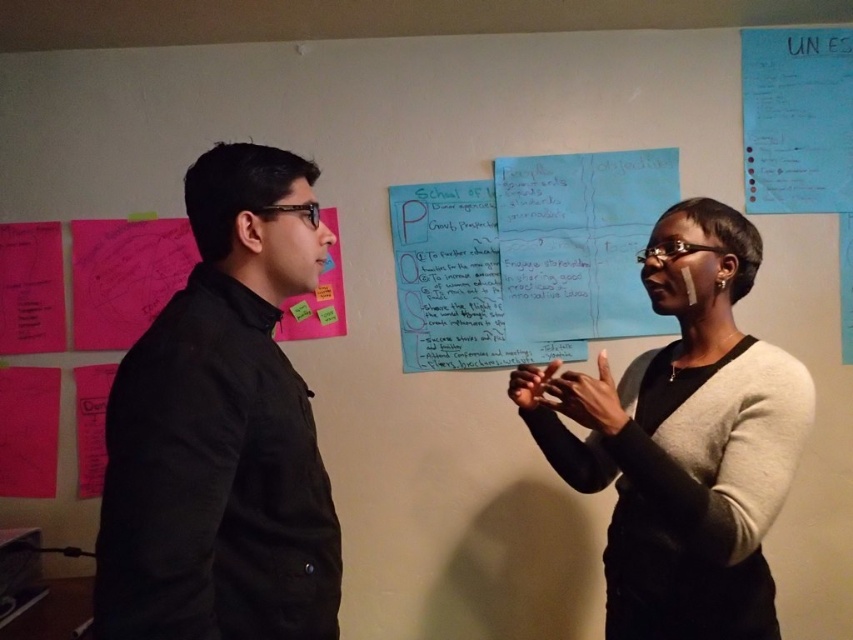
You are standing in the room where the discussion is happening. You need to locate the black matte jacket at left. Where exactly is it positioned in the room?

The black matte jacket at left is positioned at point (222, 429) in the room.

You are a photographer standing 10 feet away from the two people in the image. You want to take a photo that includes both the black matte jacket at left and the black matte sweater at center without zooming. What is the minimum width of your camera lens in inches to capture both objects in the frame?

The black matte jacket at left and the black matte sweater at center are 23.94 inches apart from each other. To capture both objects without zooming, the camera lens must have a minimum width of at least 23.94 inches to ensure both are in frame.

You are standing in the room and want to hand a document to the person wearing the black matte sweater at center without moving the other person wearing the black matte jacket at left. Is this possible?

The black matte jacket at left is closer to the viewer than the black matte sweater at center, so you can walk around the jacket to reach the sweater wearer without moving them.